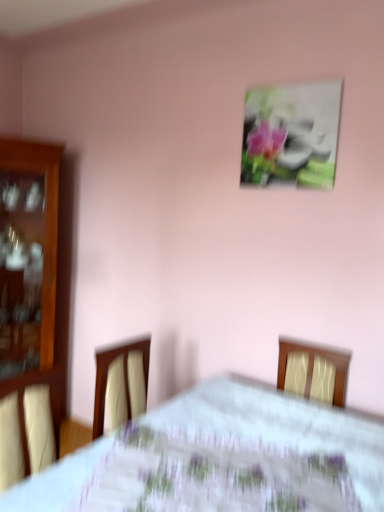
Question: Is white floral tablecloth at center positioned beyond the bounds of wooden cabinet at left?

Choices:
 (A) yes
 (B) no

Answer: (A)

Question: Can you confirm if white floral tablecloth at center is positioned to the left of wooden cabinet at left?

Choices:
 (A) no
 (B) yes

Answer: (A)

Question: Is the surface of white floral tablecloth at center in direct contact with wooden cabinet at left?

Choices:
 (A) yes
 (B) no

Answer: (B)

Question: Is white floral tablecloth at center oriented away from wooden cabinet at left?

Choices:
 (A) yes
 (B) no

Answer: (B)

Question: Is white floral tablecloth at center far from wooden cabinet at left?

Choices:
 (A) yes
 (B) no

Answer: (A)

Question: From the image's perspective, is white floral tablecloth at center beneath wooden cabinet at left?

Choices:
 (A) yes
 (B) no

Answer: (A)

Question: Considering the relative sizes of wooden cabinet at left and white floral tablecloth at center in the image provided, is wooden cabinet at left bigger than white floral tablecloth at center?

Choices:
 (A) yes
 (B) no

Answer: (B)

Question: Is wooden cabinet at left at the left side of white floral tablecloth at center?

Choices:
 (A) yes
 (B) no

Answer: (A)

Question: Is wooden cabinet at left at the right side of white floral tablecloth at center?

Choices:
 (A) yes
 (B) no

Answer: (B)

Question: Can you confirm if wooden cabinet at left is thinner than white floral tablecloth at center?

Choices:
 (A) yes
 (B) no

Answer: (A)

Question: Is wooden cabinet at left positioned far away from white floral tablecloth at center?

Choices:
 (A) yes
 (B) no

Answer: (A)

Question: Can you confirm if wooden cabinet at left is shorter than white floral tablecloth at center?

Choices:
 (A) no
 (B) yes

Answer: (A)

Question: Would you say white floral tablecloth at center contains metallic silver frame at upper center?

Choices:
 (A) no
 (B) yes

Answer: (A)